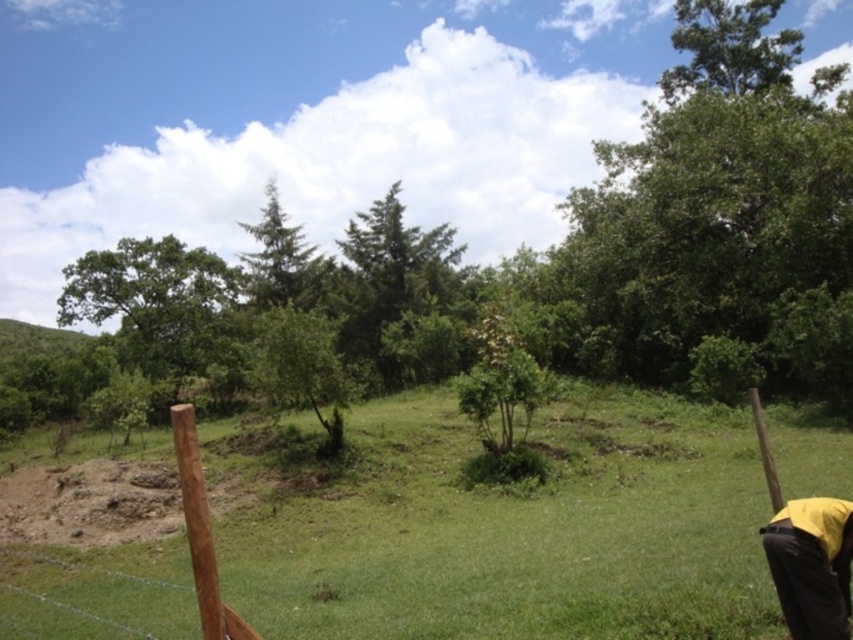
Question: Which object appears farthest from the camera in this image?

Choices:
 (A) green leafy tree at center
 (B) green matte tree at center
 (C) green grassy at center
 (D) black/yellow jacket at lower right

Answer: (B)

Question: Is green leafy tree at center positioned in front of brown wooden post at lower left?

Choices:
 (A) yes
 (B) no

Answer: (B)

Question: Does green grassy at center have a greater width compared to green leafy tree at center?

Choices:
 (A) no
 (B) yes

Answer: (B)

Question: Which point appears farthest from the camera in this image?

Choices:
 (A) (283, 355)
 (B) (274, 292)
 (C) (457, 632)
 (D) (193, 564)

Answer: (B)

Question: Is green grassy at center to the left of black/yellow jacket at lower right from the viewer's perspective?

Choices:
 (A) yes
 (B) no

Answer: (A)

Question: Which point is farther to the camera?

Choices:
 (A) green grassy at center
 (B) brown wooden post at lower left

Answer: (A)